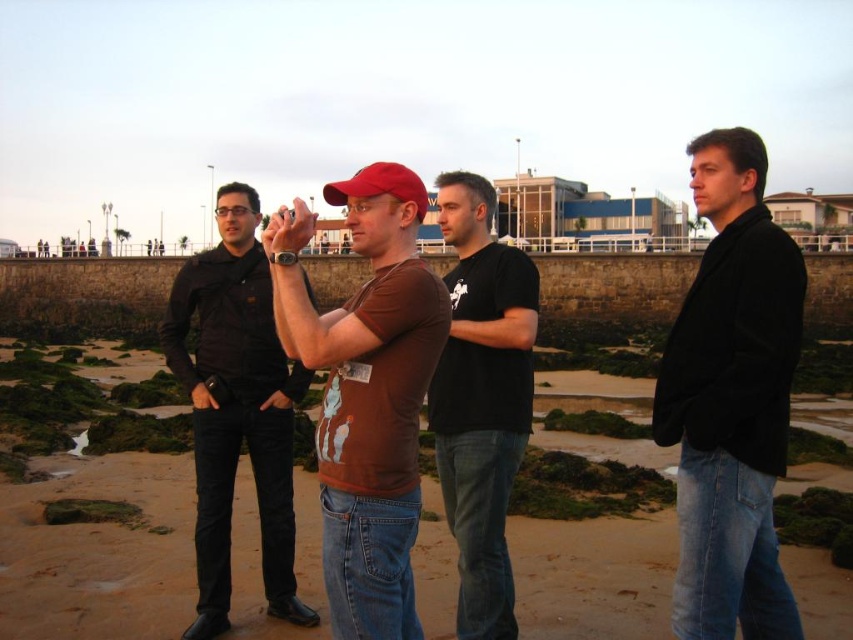
Describe the element at coordinates (366, 392) in the screenshot. I see `brown cotton t-shirt at center` at that location.

Does brown cotton t-shirt at center have a smaller size compared to matte red baseball cap at center?

Actually, brown cotton t-shirt at center might be larger than matte red baseball cap at center.

Which is behind, point (370, 224) or point (399, 177)?

Point (370, 224)

I want to click on brown cotton t-shirt at center, so click(366, 392).

Where is `black cotton t-shirt at center`? This screenshot has width=853, height=640. black cotton t-shirt at center is located at coordinates (x=480, y=397).

Is black cotton t-shirt at center closer to the viewer compared to matte red baseball cap at center?

No, it is not.

I want to click on black cotton t-shirt at center, so click(x=480, y=397).

Does point (750, 451) come farther from viewer compared to point (416, 426)?

That is False.

Does black cotton jacket at right have a lesser width compared to brown cotton t-shirt at center?

In fact, black cotton jacket at right might be wider than brown cotton t-shirt at center.

I want to click on black cotton jacket at right, so click(730, 400).